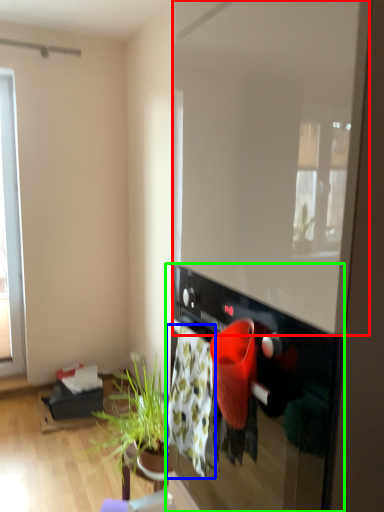
Question: Which object is positioned farthest from window screen (highlighted by a red box)? Select from blanket (highlighted by a blue box) and oven (highlighted by a green box).

Choices:
 (A) blanket
 (B) oven

Answer: (A)